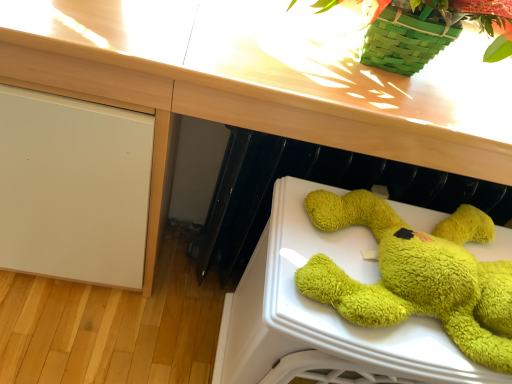
Question: Is green fuzzy stuffed animal at lower right far from wooden at upper center?

Choices:
 (A) no
 (B) yes

Answer: (A)

Question: Considering the relative positions of green fuzzy stuffed animal at lower right and wooden at upper center in the image provided, is green fuzzy stuffed animal at lower right to the right of wooden at upper center from the viewer's perspective?

Choices:
 (A) no
 (B) yes

Answer: (B)

Question: Could you tell me if green fuzzy stuffed animal at lower right is turned towards wooden at upper center?

Choices:
 (A) yes
 (B) no

Answer: (B)

Question: Considering the relative sizes of green fuzzy stuffed animal at lower right and wooden at upper center in the image provided, is green fuzzy stuffed animal at lower right shorter than wooden at upper center?

Choices:
 (A) no
 (B) yes

Answer: (B)

Question: Is green fuzzy stuffed animal at lower right positioned before wooden at upper center?

Choices:
 (A) yes
 (B) no

Answer: (A)

Question: Is green fuzzy stuffed animal at lower right positioned with its back to wooden at upper center?

Choices:
 (A) yes
 (B) no

Answer: (B)

Question: Is wooden at upper center positioned behind green fuzzy stuffed animal at lower right?

Choices:
 (A) yes
 (B) no

Answer: (A)

Question: Could you tell me if wooden at upper center is facing green fuzzy stuffed animal at lower right?

Choices:
 (A) yes
 (B) no

Answer: (B)

Question: Is wooden at upper center wider than green fuzzy stuffed animal at lower right?

Choices:
 (A) no
 (B) yes

Answer: (B)

Question: Is wooden at upper center thinner than green fuzzy stuffed animal at lower right?

Choices:
 (A) yes
 (B) no

Answer: (B)

Question: Is wooden at upper center turned away from green fuzzy stuffed animal at lower right?

Choices:
 (A) yes
 (B) no

Answer: (B)

Question: Can we say wooden at upper center lies outside green fuzzy stuffed animal at lower right?

Choices:
 (A) yes
 (B) no

Answer: (A)

Question: Is green fuzzy stuffed animal at lower right spatially inside wooden at upper center, or outside of it?

Choices:
 (A) inside
 (B) outside

Answer: (B)